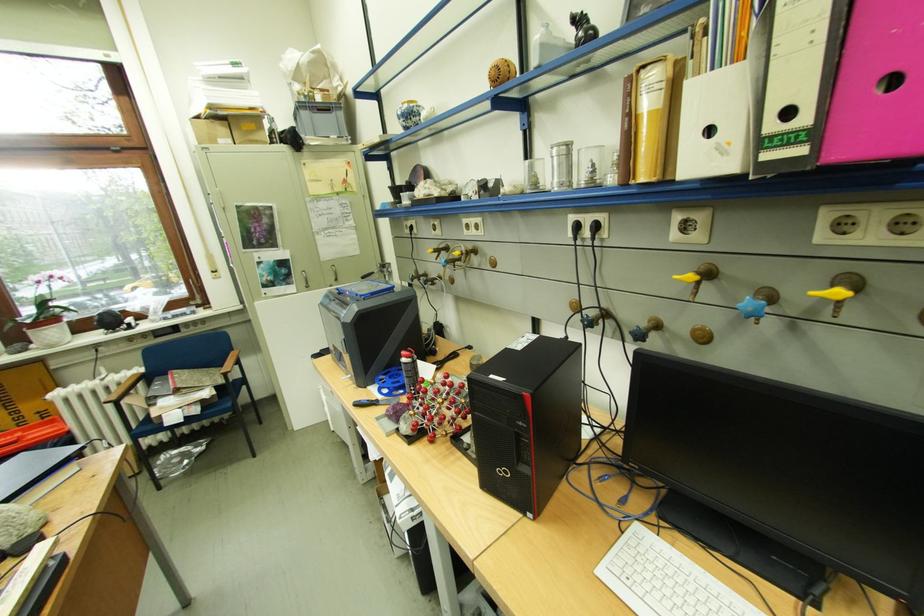
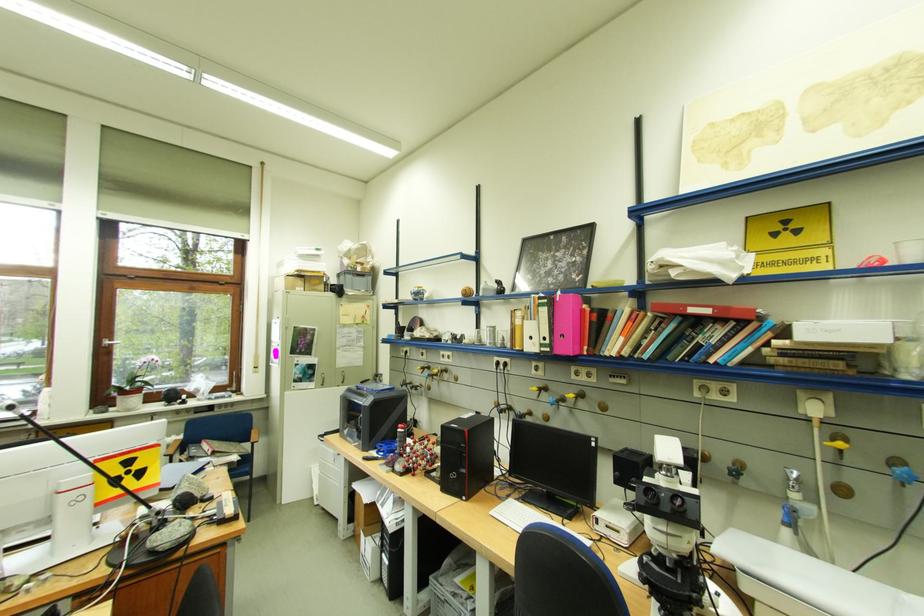
In the second image, find the point that corresponds to (451,248) in the first image.

(435, 367)